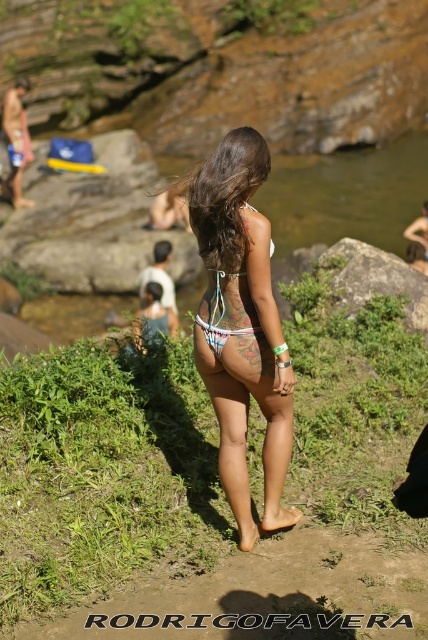
Question: Is white string bikini at center below white fabric bikini at center?

Choices:
 (A) yes
 (B) no

Answer: (A)

Question: Does gray rock at center have a larger size compared to white fabric bikini at center?

Choices:
 (A) yes
 (B) no

Answer: (A)

Question: Considering the real-world distances, which object is closest to the white string bikini at center?

Choices:
 (A) gray rock at center
 (B) white fabric bikini at center

Answer: (B)

Question: Estimate the real-world distances between objects in this image. Which object is farther from the gray rock at center?

Choices:
 (A) white string bikini at center
 (B) white fabric bikini at center

Answer: (B)

Question: Does gray rock at center appear under white fabric bikini at center?

Choices:
 (A) no
 (B) yes

Answer: (A)

Question: Which object appears closest to the camera in this image?

Choices:
 (A) white fabric bikini at center
 (B) gray rock at center
 (C) white string bikini at center

Answer: (A)